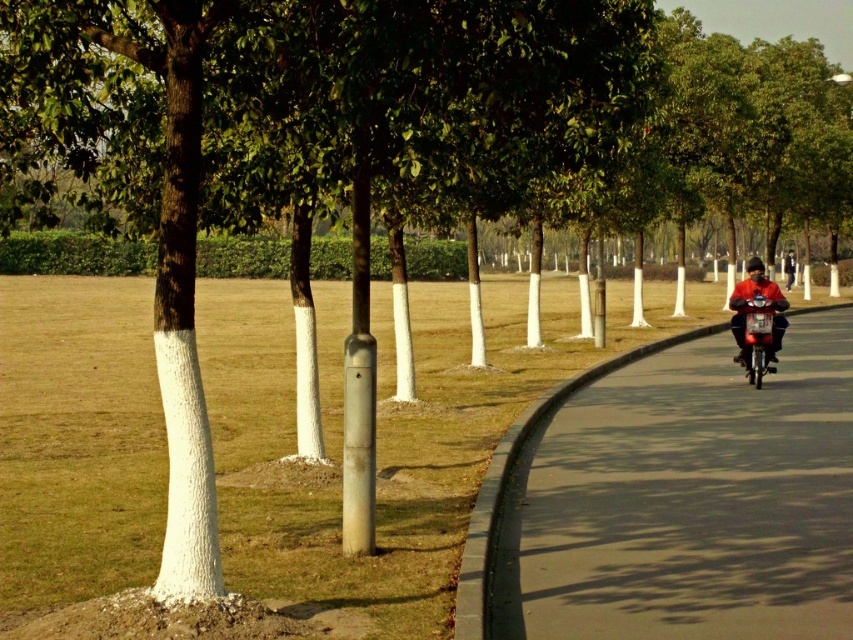
Measure the distance between smooth asphalt road at right and camera.

smooth asphalt road at right is 23.67 feet from camera.

Which is behind, point (653, 481) or point (741, 282)?

The point (741, 282) is more distant.

Is point (833, 339) closer to viewer compared to point (766, 298)?

No, (833, 339) is further to viewer.

Identify the location of smooth asphalt road at right. The width and height of the screenshot is (853, 640). (686, 500).